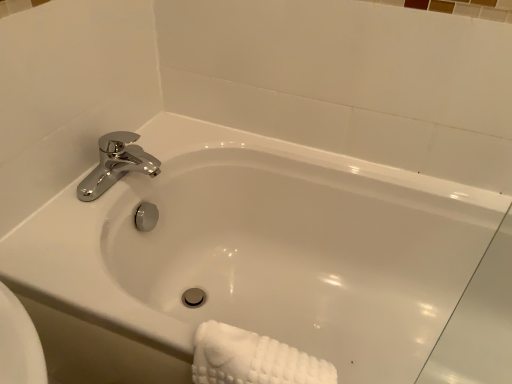
The width and height of the screenshot is (512, 384). I want to click on white glossy bathtub at center, so tap(264, 249).

I want to click on white textured towel at lower right, so click(x=252, y=359).

Locate an element on the screen. chrome metallic faucet at upper left is located at coordinates (116, 164).

The image size is (512, 384). What are the coordinates of `bathtub that appears below the chrome metallic faucet at upper left (from the image's perspective)` in the screenshot? It's located at (264, 249).

Is white glossy bathtub at center taller than chrome metallic faucet at upper left?

Indeed, white glossy bathtub at center has a greater height compared to chrome metallic faucet at upper left.

Based on the photo, from the image's perspective, is white glossy bathtub at center on top of chrome metallic faucet at upper left?

No, from the image's perspective, white glossy bathtub at center is not above chrome metallic faucet at upper left.

Does point (334, 356) come behind point (94, 191)?

Yes, point (334, 356) is farther from viewer.

From a real-world perspective, is chrome metallic faucet at upper left under white textured towel at lower right?

Actually, chrome metallic faucet at upper left is physically above white textured towel at lower right in the real world.

Considering the sizes of objects chrome metallic faucet at upper left and white textured towel at lower right in the image provided, who is wider, chrome metallic faucet at upper left or white textured towel at lower right?

chrome metallic faucet at upper left.

Can white textured towel at lower right be found inside chrome metallic faucet at upper left?

No, white textured towel at lower right is located outside of chrome metallic faucet at upper left.

Can you tell me how much chrome metallic faucet at upper left and white textured towel at lower right differ in facing direction?

The angular difference between chrome metallic faucet at upper left and white textured towel at lower right is 86.5 degrees.

From a real-world perspective, is white textured towel at lower right on chrome metallic faucet at upper left?

No.

Is point (197, 330) closer or farther from the camera than point (148, 156)?

Point (197, 330) appears to be closer to the viewer than point (148, 156).

Which of these two, white textured towel at lower right or chrome metallic faucet at upper left, stands taller?

Standing taller between the two is white textured towel at lower right.

In the image, is white textured towel at lower right positioned in front of or behind chrome metallic faucet at upper left?

Visually, white textured towel at lower right is located in front of chrome metallic faucet at upper left.

Would you say white textured towel at lower right is part of white glossy bathtub at center's contents?

→ Yes, white glossy bathtub at center is surrounding white textured towel at lower right.

Which is nearer, (396, 314) or (318, 359)?

Point (396, 314).

Between white glossy bathtub at center and white textured towel at lower right, which one appears on the right side from the viewer's perspective?

white glossy bathtub at center is more to the right.

I want to click on bathtub that is on the right side of white textured towel at lower right, so coord(264,249).

Can you tell me how much white textured towel at lower right and white glossy bathtub at center differ in facing direction?

There is a 1.85-degree angle between the facing directions of white textured towel at lower right and white glossy bathtub at center.

Is white glossy bathtub at center at the back of white textured towel at lower right?

Yes, white glossy bathtub at center is at the back of white textured towel at lower right.

Is white textured towel at lower right at the right side of white glossy bathtub at center?

In fact, white textured towel at lower right is to the left of white glossy bathtub at center.

Considering the relative sizes of chrome metallic faucet at upper left and white glossy bathtub at center in the image provided, is chrome metallic faucet at upper left taller than white glossy bathtub at center?

No, chrome metallic faucet at upper left is not taller than white glossy bathtub at center.

How many degrees apart are the facing directions of chrome metallic faucet at upper left and white glossy bathtub at center?

The facing directions of chrome metallic faucet at upper left and white glossy bathtub at center are 88.3 degrees apart.

From the image's perspective, is chrome metallic faucet at upper left on white glossy bathtub at center?

Yes, from the image's perspective, chrome metallic faucet at upper left is above white glossy bathtub at center.

From a real-world perspective, which is physically below, chrome metallic faucet at upper left or white glossy bathtub at center?

From a 3D spatial view, white glossy bathtub at center is below.

You are a GUI agent. You are given a task and a screenshot of the screen. Output one action in this format:
    pyautogui.click(x=<x>, y=<y>)
    Task: Click on the tap behind the white glossy bathtub at center
    The width and height of the screenshot is (512, 384).
    Given the screenshot: What is the action you would take?
    pyautogui.click(x=116, y=164)

This screenshot has height=384, width=512. Identify the location of bath towel in front of the chrome metallic faucet at upper left. (252, 359).

From the image, which object appears to be nearer to chrome metallic faucet at upper left, white textured towel at lower right or white glossy bathtub at center?

Among the two, white glossy bathtub at center is located nearer to chrome metallic faucet at upper left.

Which object lies nearer to the anchor point white glossy bathtub at center, chrome metallic faucet at upper left or white textured towel at lower right?

chrome metallic faucet at upper left lies closer to white glossy bathtub at center than the other object.

Which object lies nearer to the anchor point white textured towel at lower right, chrome metallic faucet at upper left or white glossy bathtub at center?

white glossy bathtub at center.

When comparing their distances from white textured towel at lower right, does white glossy bathtub at center or chrome metallic faucet at upper left seem closer?

Based on the image, white glossy bathtub at center appears to be nearer to white textured towel at lower right.

Considering their positions, is white textured towel at lower right positioned closer to white glossy bathtub at center than chrome metallic faucet at upper left?

chrome metallic faucet at upper left lies closer to white glossy bathtub at center than the other object.

When comparing their distances from chrome metallic faucet at upper left, does white glossy bathtub at center or white textured towel at lower right seem further?

white textured towel at lower right is further to chrome metallic faucet at upper left.

Locate an element on the screen. The image size is (512, 384). bathtub that lies between chrome metallic faucet at upper left and white textured towel at lower right from top to bottom is located at coordinates (264, 249).